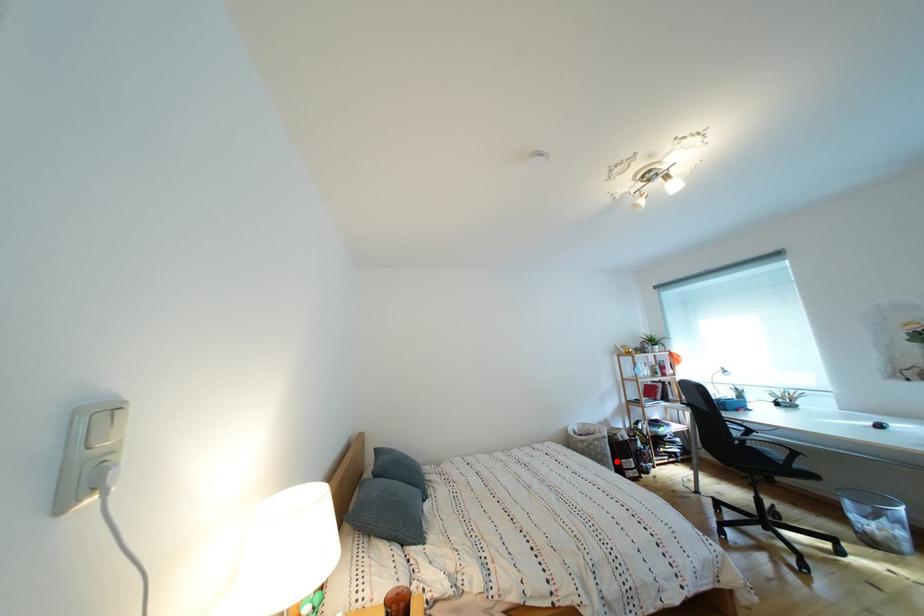
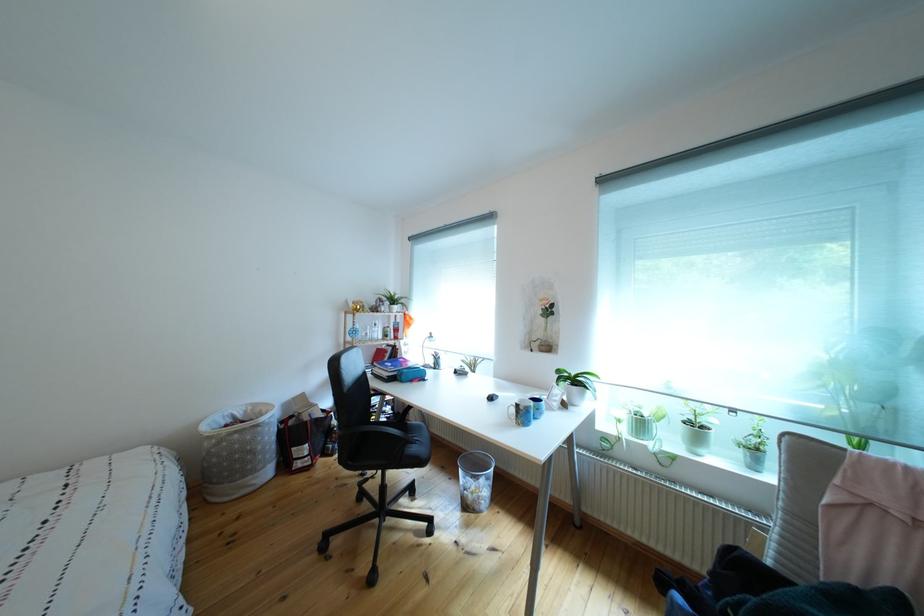
Find the pixel in the second image that matches the highlighted location in the first image.

(263, 456)